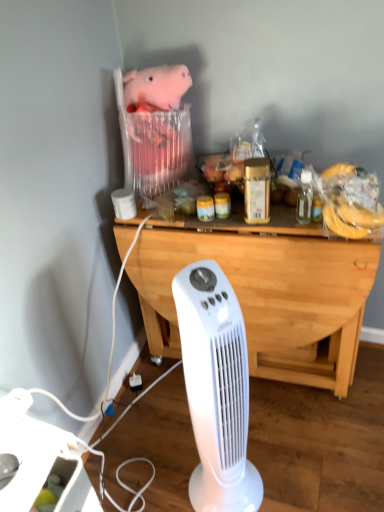
In order to click on spots to the right of white plastic fan at center in this screenshot , I will do `click(286, 468)`.